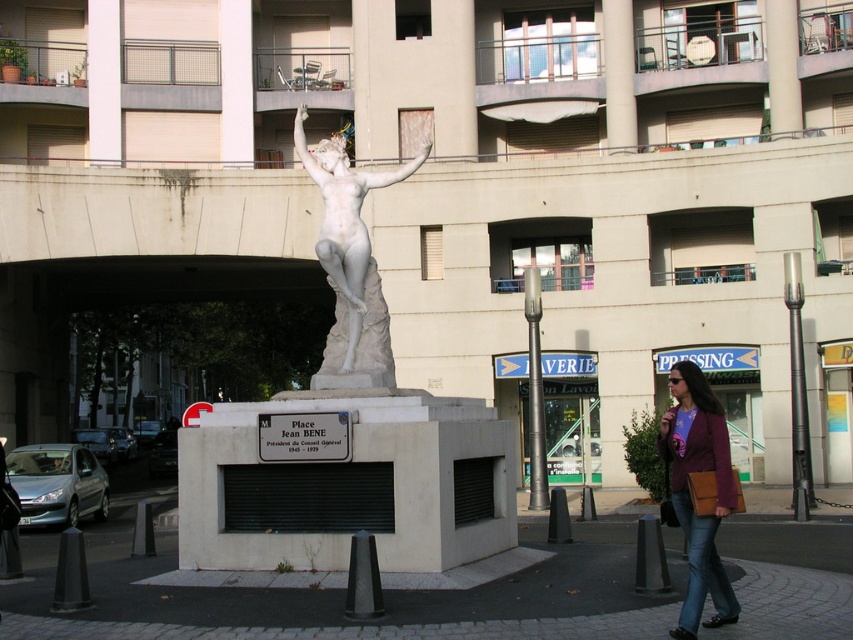
You are a photographer setting up a tripod in the plaza. You need to position it so that both the purple leather jacket at lower right and the white marble statue at center are visible in the frame. Given their sizes, which object will require more space in the composition?

The white marble statue at center requires more space in the composition because it occupies more space than the purple leather jacket at lower right.